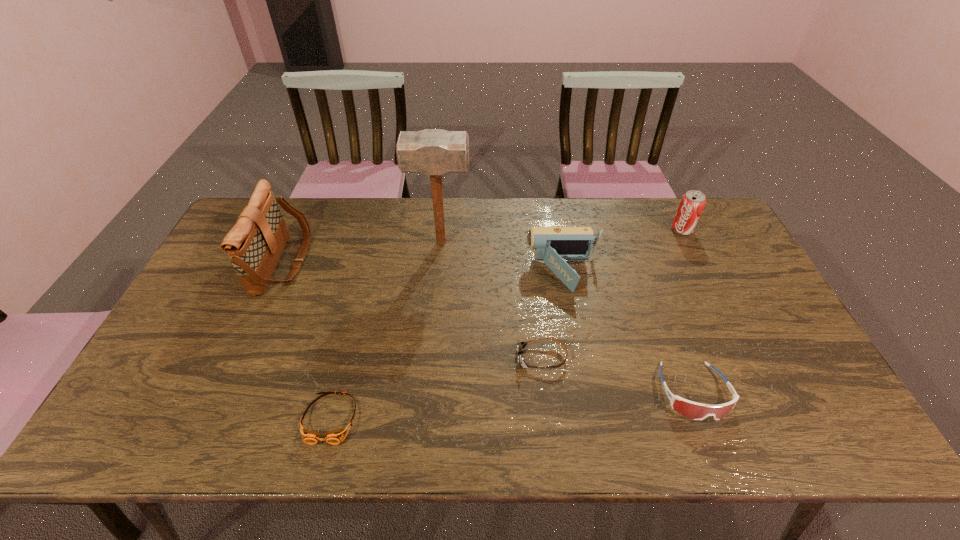
This screenshot has width=960, height=540. I want to click on the fifth object from right to left, so click(434, 152).

Locate an element on the screen. mallet is located at coordinates (434, 152).

Locate an element on the screen. This screenshot has width=960, height=540. the leftmost object is located at coordinates (254, 245).

In order to click on the sixth shortest object in this screenshot , I will do `click(254, 245)`.

Find the location of a particular element. soda can is located at coordinates (692, 203).

Where is `camcorder`? Image resolution: width=960 pixels, height=540 pixels. camcorder is located at coordinates (552, 245).

At what (x,y) coordinates should I click in order to perform the action: click on the third shortest object. Please return your answer as a coordinate pair (x, y). Image resolution: width=960 pixels, height=540 pixels. Looking at the image, I should click on (697, 411).

In order to click on the second object from right to left in this screenshot , I will do `click(697, 411)`.

The image size is (960, 540). Identify the location of the second goggles from right to left. (520, 346).

This screenshot has width=960, height=540. I want to click on the second object from left to right, so click(334, 437).